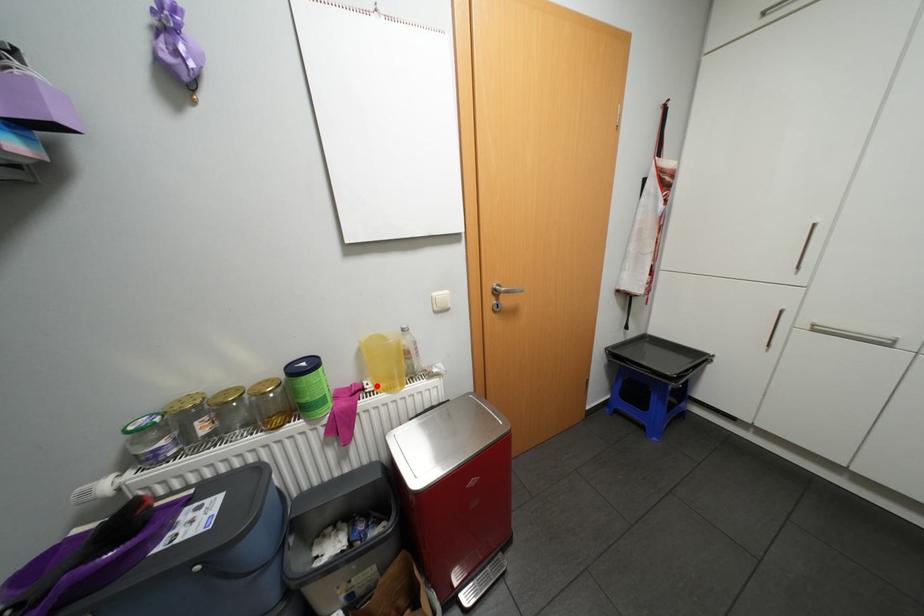
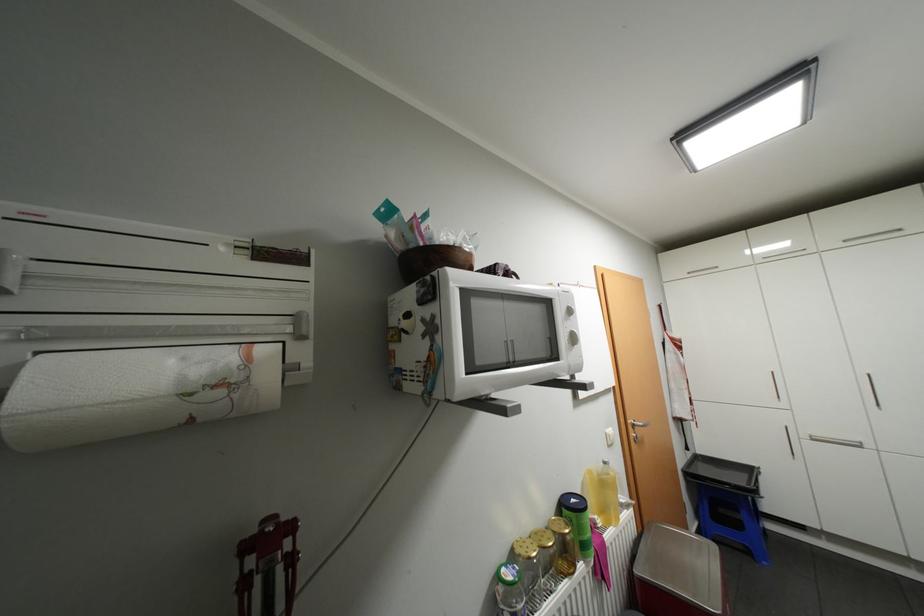
Locate, in the second image, the point that corresponds to the highlighted location in the first image.

(606, 521)